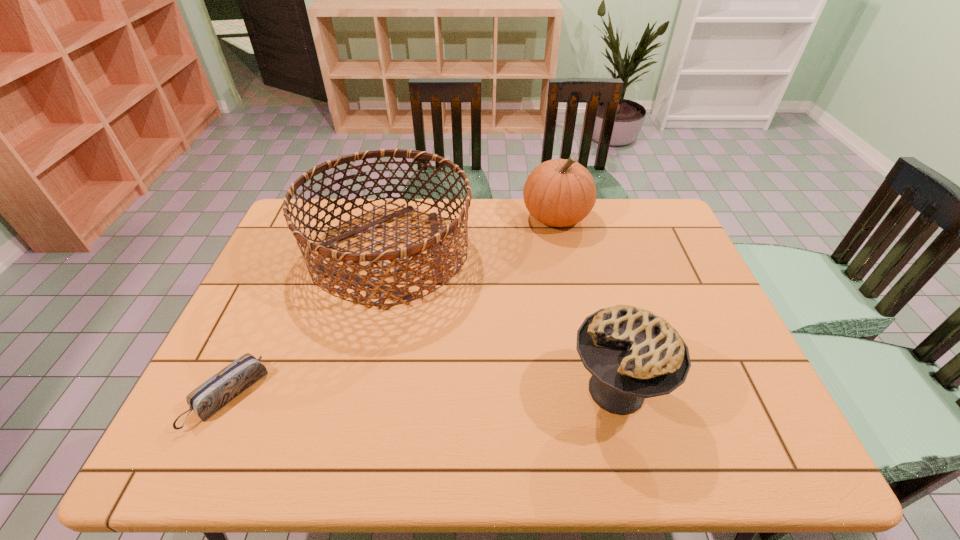
In order to click on pumpkin in this screenshot , I will do `click(560, 192)`.

Where is `basket`? Image resolution: width=960 pixels, height=540 pixels. basket is located at coordinates (396, 293).

The image size is (960, 540). What are the coordinates of `pie` in the screenshot? It's located at (632, 354).

Identify the location of the shortest object. (217, 391).

The width and height of the screenshot is (960, 540). What are the coordinates of `vacant space situated 0.080m on the stem of the pumpkin` in the screenshot? It's located at (564, 255).

Identify the location of free space located 0.310m on the front of the basket. The height and width of the screenshot is (540, 960). (351, 423).

The height and width of the screenshot is (540, 960). What are the coordinates of `free space located 0.220m on the cut side of the pie` in the screenshot? It's located at (472, 390).

The width and height of the screenshot is (960, 540). I want to click on vacant space located 0.140m on the cut side of the pie, so click(507, 390).

At what (x,y) coordinates should I click in order to perform the action: click on vacant space located on the cut side of the pie. Please return your answer as a coordinate pair (x, y). Looking at the image, I should click on (515, 390).

I want to click on free spot located 0.170m on the back of the pencil box, so click(x=268, y=312).